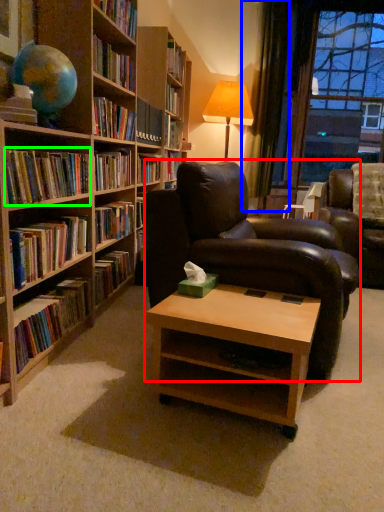
Question: Which object is the farthest from chair (highlighted by a red box)? Choose among these: curtain (highlighted by a blue box) or book (highlighted by a green box).

Choices:
 (A) curtain
 (B) book

Answer: (A)